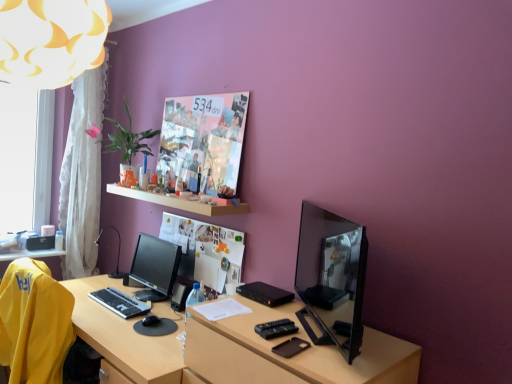
In order to click on free point above black plastic keyboard at lower left (from a real-world perspective) in this screenshot , I will do `click(120, 292)`.